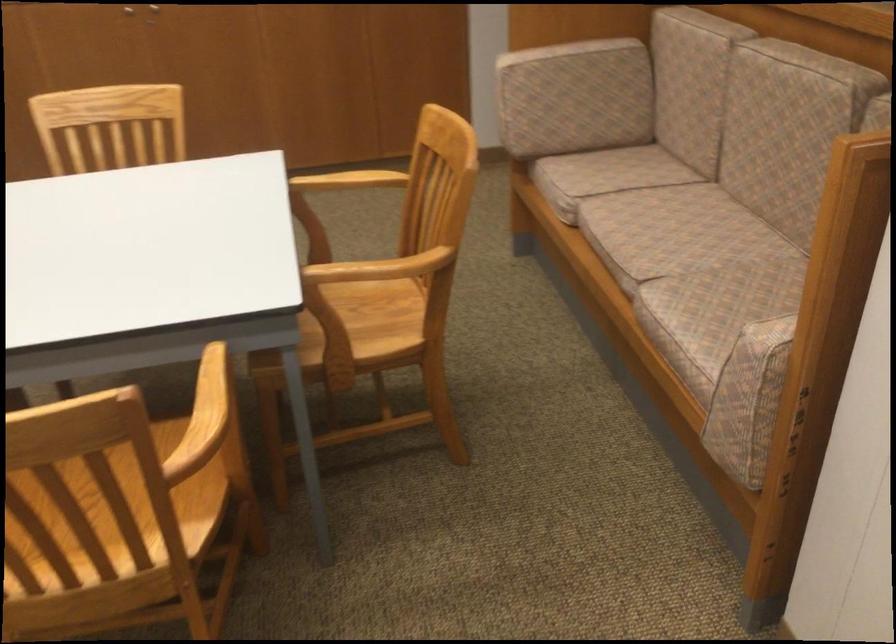
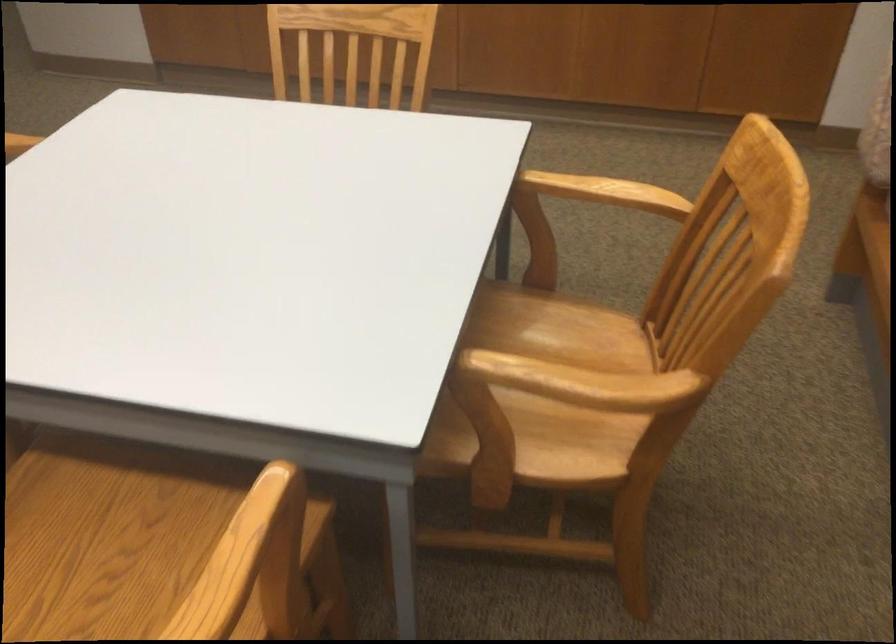
Find the pixel in the second image that matches point (348, 176) in the first image.

(605, 192)